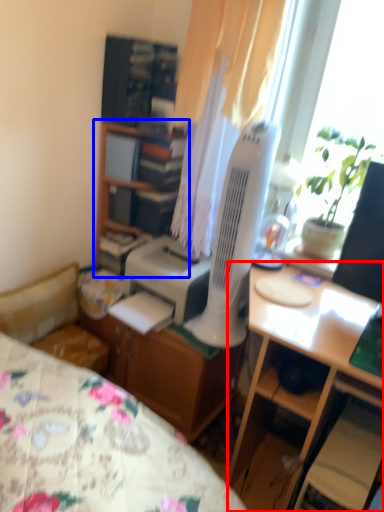
Question: Which object appears farthest to the camera in this image, desk (highlighted by a red box) or cabinetry (highlighted by a blue box)?

Choices:
 (A) desk
 (B) cabinetry

Answer: (B)